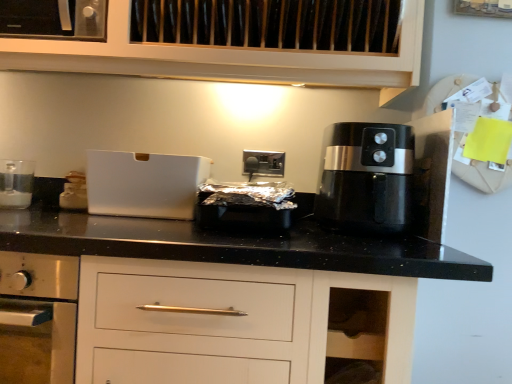
Question: Should I look upward or downward to see white matte bread box at left, which is the 2th kitchen appliance in left-to-right order?

Choices:
 (A) up
 (B) down

Answer: (B)

Question: Is there a large distance between white matte bread box at left, which is the 2th kitchen appliance in left-to-right order, and satin silver outlet at center?

Choices:
 (A) yes
 (B) no

Answer: (B)

Question: Can we say white matte bread box at left, which is the 2th kitchen appliance in left-to-right order, lies outside satin silver outlet at center?

Choices:
 (A) yes
 (B) no

Answer: (A)

Question: Does white matte bread box at left, acting as the 1th kitchen appliance starting from the right, have a lesser width compared to satin silver outlet at center?

Choices:
 (A) no
 (B) yes

Answer: (A)

Question: Is white matte bread box at left, acting as the 1th kitchen appliance starting from the right, wider than satin silver outlet at center?

Choices:
 (A) no
 (B) yes

Answer: (B)

Question: From a real-world perspective, is white matte bread box at left, acting as the 1th kitchen appliance starting from the right, on satin silver outlet at center?

Choices:
 (A) yes
 (B) no

Answer: (B)

Question: Does white matte bread box at left, which is the 2th kitchen appliance in left-to-right order, appear on the right side of satin silver outlet at center?

Choices:
 (A) yes
 (B) no

Answer: (B)

Question: Does white matte bread box at left, which is the 2th kitchen appliance in left-to-right order, lie in front of white matte box at center?

Choices:
 (A) no
 (B) yes

Answer: (A)

Question: Could you tell me if white matte bread box at left, acting as the 1th kitchen appliance starting from the right, is turned towards white matte box at center?

Choices:
 (A) yes
 (B) no

Answer: (B)

Question: From the image's perspective, does white matte bread box at left, which is the 2th kitchen appliance in left-to-right order, appear higher than white matte box at center?

Choices:
 (A) no
 (B) yes

Answer: (A)

Question: Would you say white matte box at center is part of white matte bread box at left, acting as the 1th kitchen appliance starting from the right,'s contents?

Choices:
 (A) no
 (B) yes

Answer: (A)

Question: Can you see white matte bread box at left, acting as the 1th kitchen appliance starting from the right, touching white matte box at center?

Choices:
 (A) yes
 (B) no

Answer: (B)

Question: Would you say white matte bread box at left, acting as the 1th kitchen appliance starting from the right, is outside white matte box at center?

Choices:
 (A) yes
 (B) no

Answer: (A)

Question: Is black plastic air fryer at right facing away from satin silver outlet at center?

Choices:
 (A) yes
 (B) no

Answer: (B)